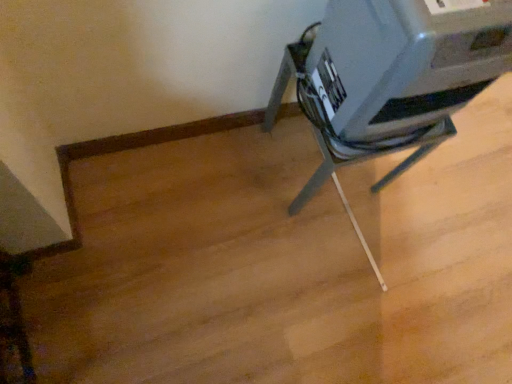
Question: Is satin gray printer at upper right outside metallic gray printer at center?

Choices:
 (A) no
 (B) yes

Answer: (B)

Question: Is satin gray printer at upper right bigger than metallic gray printer at center?

Choices:
 (A) no
 (B) yes

Answer: (A)

Question: From the image's perspective, is satin gray printer at upper right under metallic gray printer at center?

Choices:
 (A) yes
 (B) no

Answer: (B)

Question: Is satin gray printer at upper right shorter than metallic gray printer at center?

Choices:
 (A) no
 (B) yes

Answer: (B)

Question: Is satin gray printer at upper right at the left side of metallic gray printer at center?

Choices:
 (A) no
 (B) yes

Answer: (A)

Question: From the image's perspective, is satin gray printer at upper right on top of metallic gray printer at center?

Choices:
 (A) no
 (B) yes

Answer: (B)

Question: Is metallic gray printer at center next to satin gray printer at upper right and touching it?

Choices:
 (A) no
 (B) yes

Answer: (A)

Question: Can you confirm if metallic gray printer at center is positioned to the left of satin gray printer at upper right?

Choices:
 (A) yes
 (B) no

Answer: (A)

Question: From a real-world perspective, does metallic gray printer at center stand above satin gray printer at upper right?

Choices:
 (A) yes
 (B) no

Answer: (B)

Question: Is metallic gray printer at center thinner than satin gray printer at upper right?

Choices:
 (A) no
 (B) yes

Answer: (A)

Question: Considering the relative positions of metallic gray printer at center and satin gray printer at upper right in the image provided, is metallic gray printer at center behind satin gray printer at upper right?

Choices:
 (A) no
 (B) yes

Answer: (B)

Question: Is metallic gray printer at center positioned far away from satin gray printer at upper right?

Choices:
 (A) yes
 (B) no

Answer: (B)

Question: From the image's perspective, is satin gray printer at upper right positioned above or below metallic gray printer at center?

Choices:
 (A) below
 (B) above

Answer: (B)